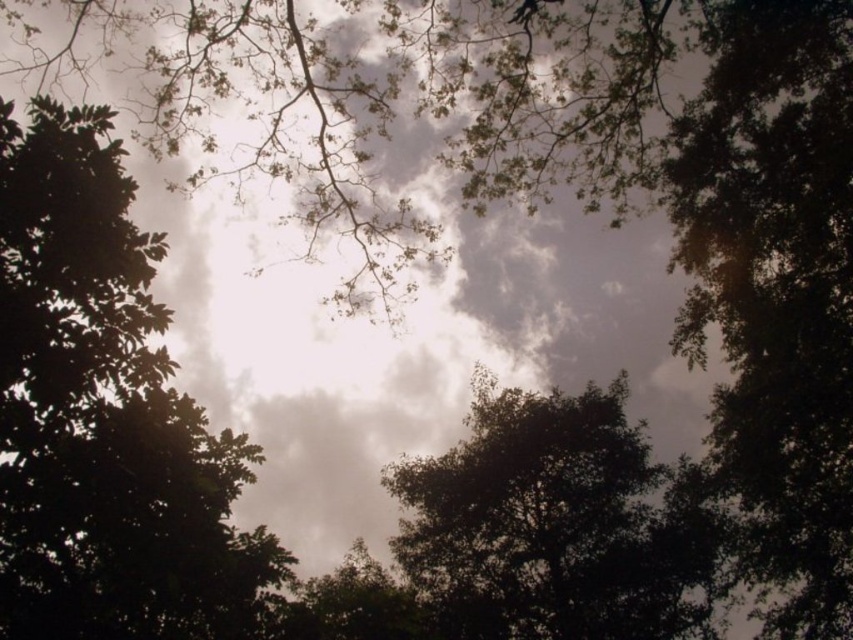
You are looking up at the tree canopy and notice a green leafy tree at upper center. Can you determine if this tree is positioned closer to the top or the bottom of the image based on its coordinates?

The green leafy tree at upper center is located at point 0.652 on the horizontal axis and 0.124 on the vertical axis. Since the vertical coordinate 0.124 is closer to 0, which typically represents the top of the image in coordinate systems, the tree is positioned closer to the top of the image.

You are standing under the trees looking up. Which tree, the green leafy tree at upper center or the dark green leafy tree at center, is closer to the clouds?

The green leafy tree at upper center is taller than the dark green leafy tree at center, so it is closer to the clouds.

You are standing below looking up at the trees. Which tree has a wider spread of branches, the green leafy tree at upper center or the dark green leafy tree at center?

The green leafy tree at upper center has a wider spread of branches than the dark green leafy tree at center.